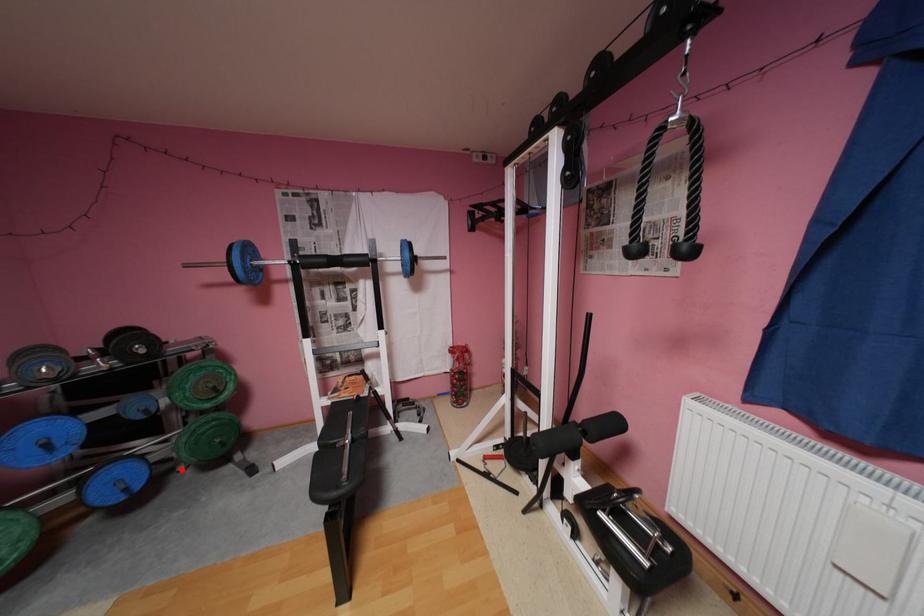
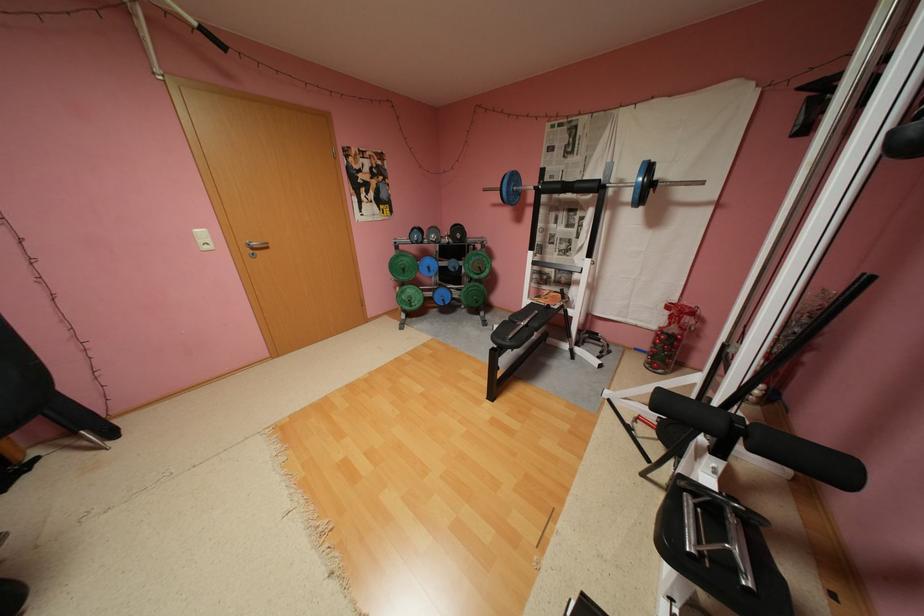
Locate, in the second image, the point that corresponds to the highlighted location in the first image.

(468, 306)